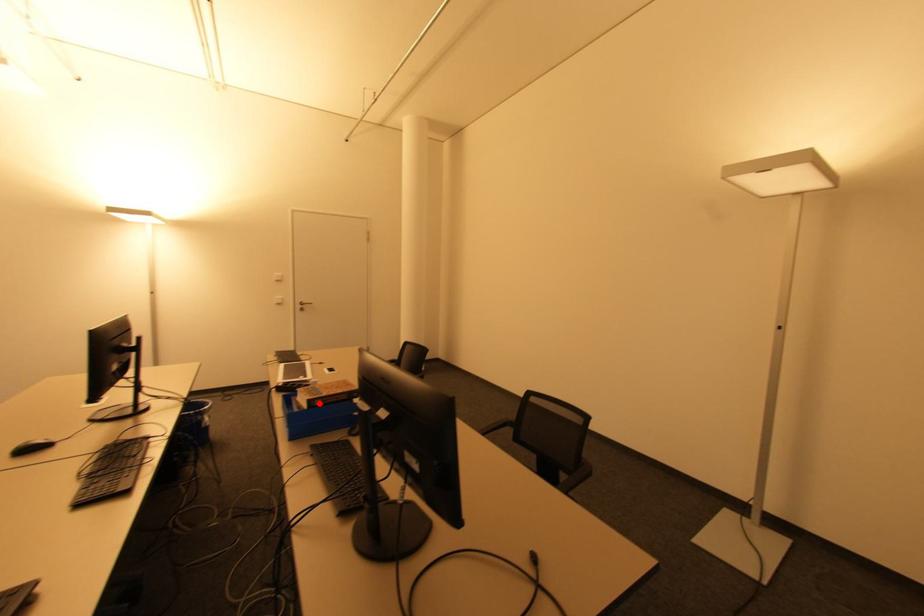
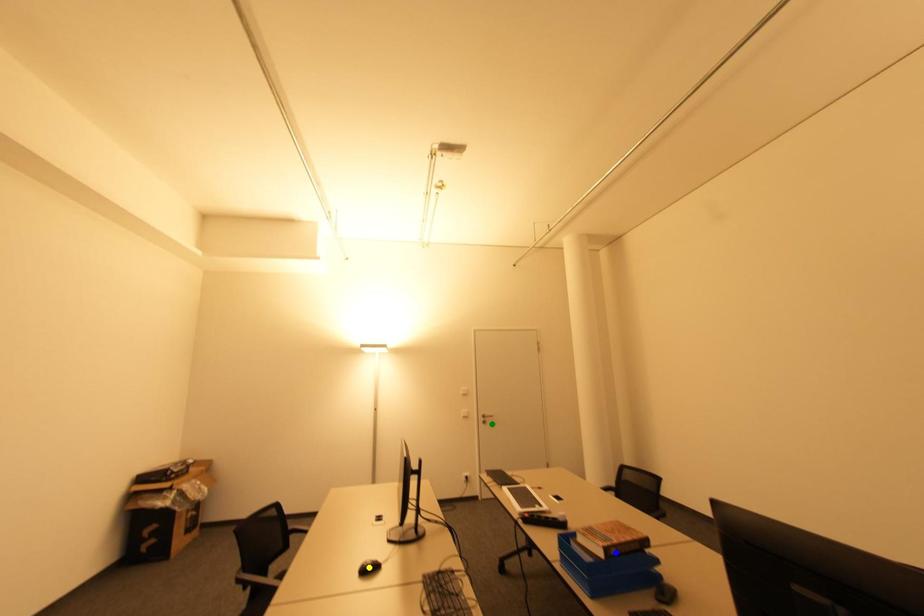
Question: I am providing you with two images of the same scene from different viewpoints. A red point is marked on the first image. You are given multiple points on the second image. Which spot in image 2 lines up with the point in image 1?

Choices:
 (A) blue point
 (B) yellow point
 (C) green point

Answer: (A)